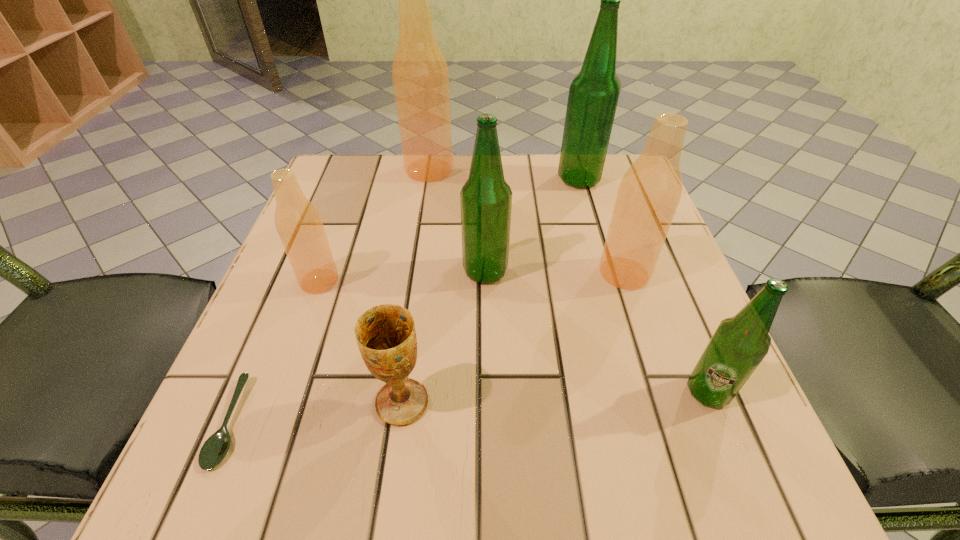
Choose which tan beer bottle is the third nearest neighbor to the second smallest green beer bottle. Please provide its 2D coordinates. Your answer should be formatted as a tuple, i.e. [(x, y)], where the tuple contains the x and y coordinates of a point satisfying the conditions above.

[(420, 75)]

Image resolution: width=960 pixels, height=540 pixels. I want to click on the second closest tan beer bottle to the fourth beer bottle from right to left, so click(299, 225).

Find the location of a particular element. vacant space that satisfies the following two spatial constraints: 1. on the back side of the leftmost tan beer bottle; 2. on the right side of the biggest tan beer bottle is located at coordinates (359, 170).

The image size is (960, 540). I want to click on vacant region that satisfies the following two spatial constraints: 1. on the back side of the second smallest tan beer bottle; 2. on the label of the fourth object from right to left, so click(624, 271).

Identify the location of vacant point that satisfies the following two spatial constraints: 1. on the back side of the shortest object; 2. on the left side of the smallest tan beer bottle. (290, 281).

The height and width of the screenshot is (540, 960). I want to click on vacant area in the image that satisfies the following two spatial constraints: 1. on the label of the rightmost tan beer bottle; 2. on the left side of the third beer bottle from left to right, so (486, 273).